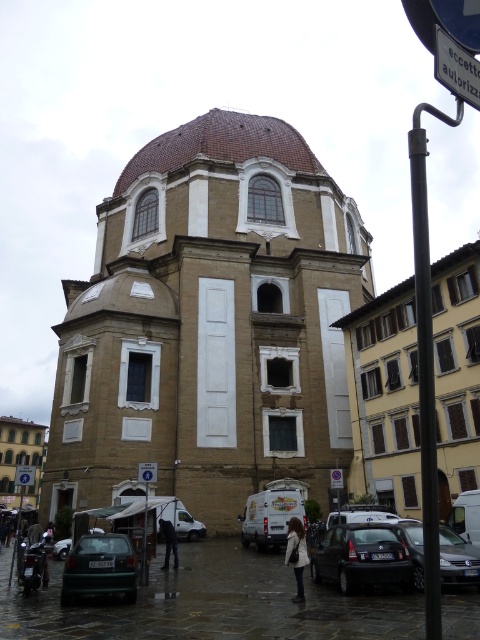
Which is more to the right, yellow matte building at center or silver metallic van at center?

yellow matte building at center

Does yellow matte building at center appear on the left side of silver metallic van at center?

In fact, yellow matte building at center is to the right of silver metallic van at center.

This screenshot has height=640, width=480. What do you see at coordinates (384, 397) in the screenshot?
I see `yellow matte building at center` at bounding box center [384, 397].

Where is `yellow matte building at center`? This screenshot has width=480, height=640. yellow matte building at center is located at coordinates (384, 397).

Is matte beige church at lower left thinner than white plastic pedestrian crossing sign at lower center?

No.

Consider the image. Can you confirm if matte beige church at lower left is positioned below white plastic pedestrian crossing sign at lower center?

Indeed, matte beige church at lower left is positioned under white plastic pedestrian crossing sign at lower center.

Who is more distant from viewer, [0,445] or [149,467]?

Point [0,445]

I want to click on matte beige church at lower left, so click(21, 460).

This screenshot has width=480, height=640. Find the location of `yellow matte building at center`. yellow matte building at center is located at coordinates (384, 397).

This screenshot has height=640, width=480. I want to click on yellow matte building at center, so click(x=384, y=397).